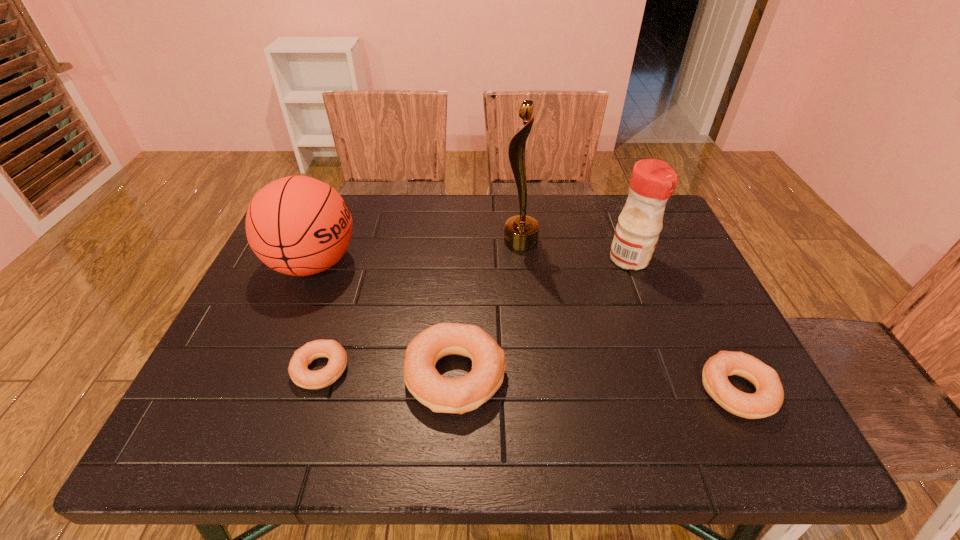
Where is `empty space between the basketball and the condiment`? The image size is (960, 540). empty space between the basketball and the condiment is located at coordinates (471, 261).

I want to click on free point between the condiment and the tallest bagel, so pos(542,318).

Identify the location of vacant area that lies between the condiment and the fourth object from right to left. The width and height of the screenshot is (960, 540). (542, 318).

Where is `empty space that is in between the second shortest object and the basketball`? empty space that is in between the second shortest object and the basketball is located at coordinates (525, 327).

The height and width of the screenshot is (540, 960). I want to click on vacant space in between the fifth tallest object and the condiment, so click(x=684, y=325).

Locate an element on the screen. empty space that is in between the rightmost bagel and the condiment is located at coordinates (684, 325).

Locate an element on the screen. This screenshot has width=960, height=540. vacant space that's between the tallest object and the shortest object is located at coordinates (420, 306).

Find the location of `free spot between the basketball and the condiment`. free spot between the basketball and the condiment is located at coordinates (471, 261).

The height and width of the screenshot is (540, 960). What are the coordinates of `free spot between the basketball and the third object from left to right` in the screenshot? It's located at (385, 320).

Where is `free space between the basketball and the second shortest object`? This screenshot has height=540, width=960. free space between the basketball and the second shortest object is located at coordinates (525, 327).